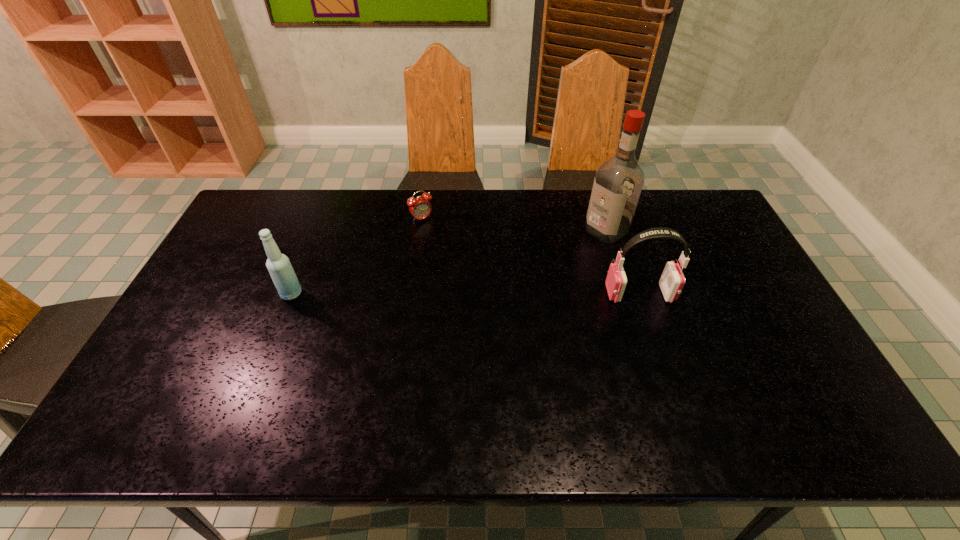
You are a GUI agent. You are given a task and a screenshot of the screen. Output one action in this format:
    pyautogui.click(x=<x>, y=<y>)
    Task: Click on the free space at the near left corner
    
    Given the screenshot: What is the action you would take?
    pyautogui.click(x=157, y=394)

Find the location of a particular element. Image resolution: width=960 pixels, height=540 pixels. vacant space at the far right corner is located at coordinates (727, 231).

In the image, there is a desktop. Identify the location of vacant space at the near right corner. The width and height of the screenshot is (960, 540). (806, 383).

Image resolution: width=960 pixels, height=540 pixels. I want to click on empty space that is in between the earphone and the shortest object, so click(x=531, y=256).

The height and width of the screenshot is (540, 960). In order to click on vacant space that's between the bottle and the shortest object in this screenshot , I will do [x=356, y=256].

The width and height of the screenshot is (960, 540). I want to click on free spot between the leftmost object and the tallest object, so click(x=448, y=262).

Where is `unoccupied position between the leftmost object and the shortest object`? This screenshot has width=960, height=540. unoccupied position between the leftmost object and the shortest object is located at coordinates (356, 256).

This screenshot has height=540, width=960. I want to click on unoccupied area between the leftmost object and the earphone, so click(x=466, y=294).

This screenshot has height=540, width=960. I want to click on free space between the earphone and the shortest object, so click(x=531, y=256).

The width and height of the screenshot is (960, 540). In order to click on vacant point located between the earphone and the leftmost object in this screenshot , I will do `click(466, 294)`.